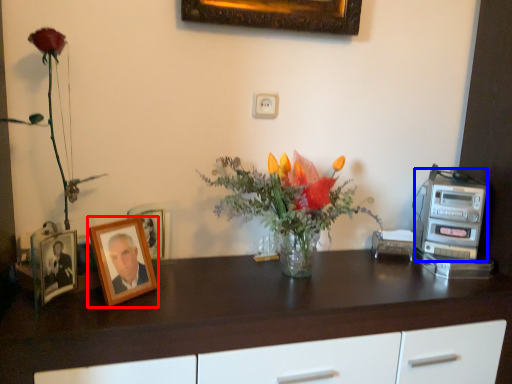
Question: Which of the following is the closest to the observer, picture frame (highlighted by a red box) or appliance (highlighted by a blue box)?

Choices:
 (A) picture frame
 (B) appliance

Answer: (A)